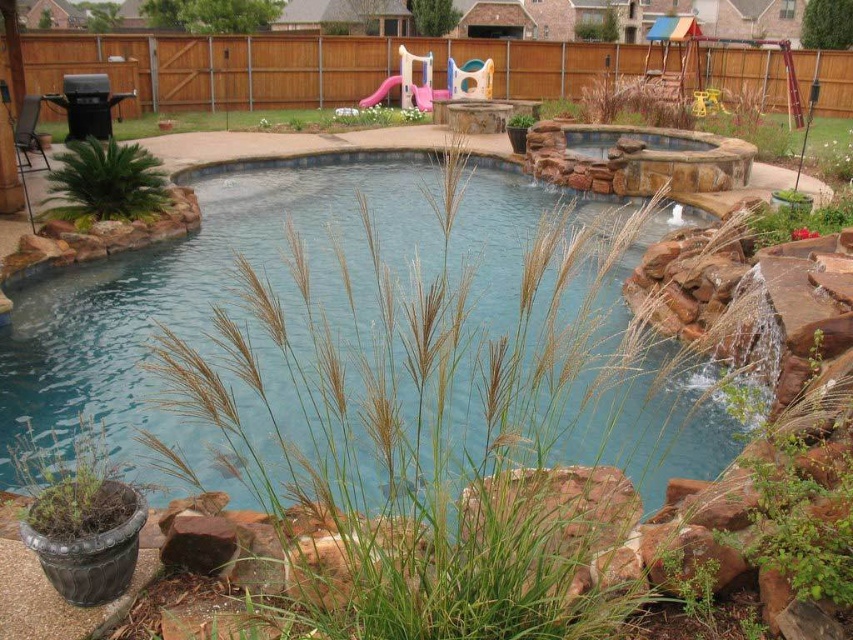
You are designing a garden layout and want to place both the green matte plant at lower left and the green leafy plant at upper center. Based on their sizes, which plant should be placed closer to the pool to ensure visibility of both plants?

The green leafy plant at upper center should be placed closer to the pool since it is smaller in size than the green matte plant at lower left, allowing both to be visible without one overshadowing the other.